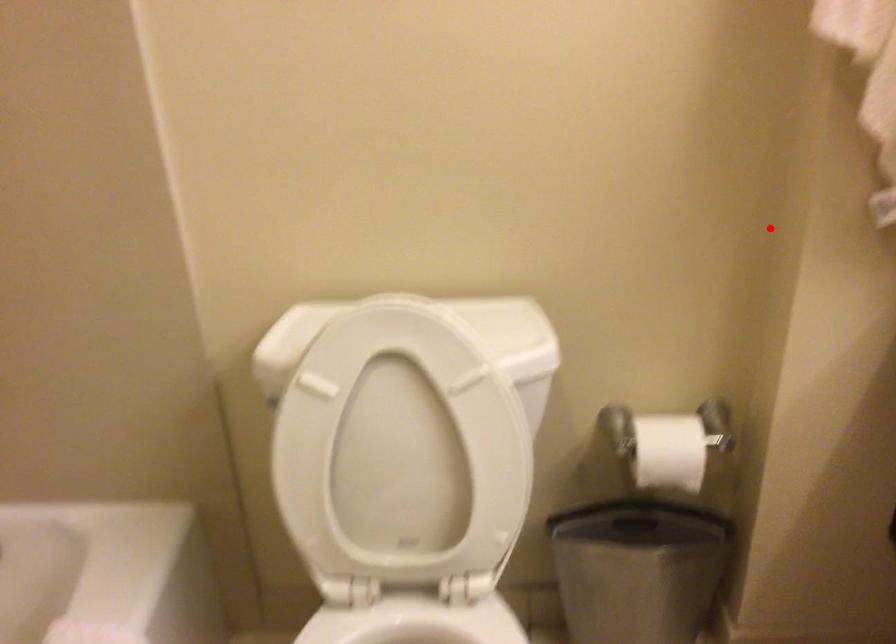
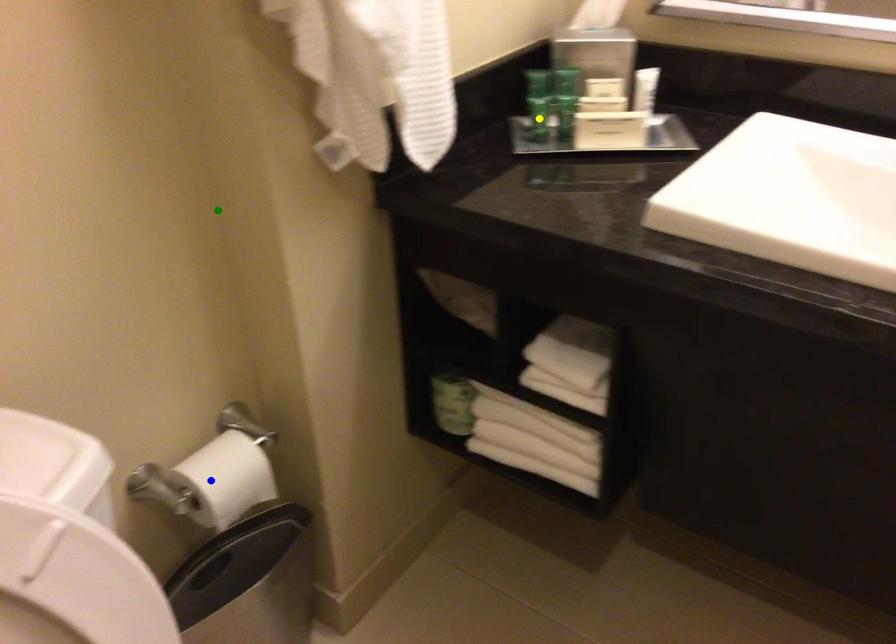
Question: I am providing you with two images of the same scene from different viewpoints. A red point is marked on the first image. You are given multiple points on the second image. Which spot in image 2 lines up with the point in image 1?

Choices:
 (A) yellow point
 (B) blue point
 (C) green point

Answer: (C)